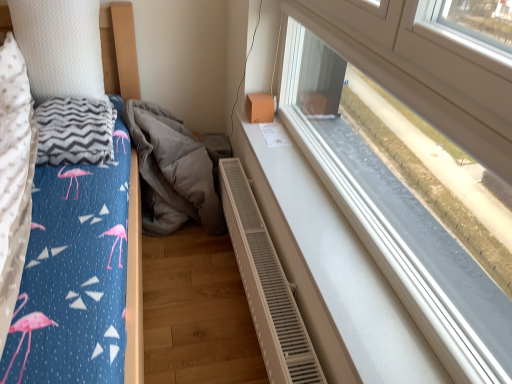
What do you see at coordinates (75, 131) in the screenshot? I see `gray zigzag-patterned blanket at left` at bounding box center [75, 131].

Image resolution: width=512 pixels, height=384 pixels. What do you see at coordinates (394, 175) in the screenshot?
I see `white plastic window at upper right` at bounding box center [394, 175].

What is the approximate height of white textured pillow at upper left?

white textured pillow at upper left is 19.61 inches tall.

Locate an element on the screen. gray zigzag-patterned blanket at left is located at coordinates (75, 131).

Based on the photo, which object is thinner, white textured radiator at lower center or white textured pillow at upper left?

With smaller width is white textured radiator at lower center.

Is the position of white textured radiator at lower center less distant than that of white textured pillow at upper left?

Yes, it is.

Identify the location of pillow lying behind the white textured radiator at lower center. The width and height of the screenshot is (512, 384). (60, 47).

Does white textured radiator at lower center have a smaller size compared to gray zigzag-patterned blanket at left?

No.

Is white textured radiator at lower center thinner than gray zigzag-patterned blanket at left?

Yes.

Which object is positioned more to the right, white textured radiator at lower center or gray zigzag-patterned blanket at left?

From the viewer's perspective, white textured radiator at lower center appears more on the right side.

Looking at this image, which is further, (133, 109) or (57, 120)?

The point (133, 109) is behind.

Is gray fabric at lower center situated inside gray zigzag-patterned blanket at left or outside?

gray fabric at lower center is not inside gray zigzag-patterned blanket at left, it's outside.

Is gray fabric at lower center in front of or behind gray zigzag-patterned blanket at left in the image?

gray fabric at lower center is positioned farther from the viewer than gray zigzag-patterned blanket at left.

From a real-world perspective, which object stands above the other?

gray zigzag-patterned blanket at left.

Which object is positioned more to the left, white plastic window at upper right or gray fabric at lower center?

Positioned to the left is gray fabric at lower center.

In the image, is white plastic window at upper right positioned in front of or behind gray fabric at lower center?

In the image, white plastic window at upper right appears in front of gray fabric at lower center.

Considering the sizes of white plastic window at upper right and gray fabric at lower center in the image, is white plastic window at upper right taller or shorter than gray fabric at lower center?

Clearly, white plastic window at upper right is taller compared to gray fabric at lower center.

Based on the photo, considering the sizes of white plastic window at upper right and gray fabric at lower center in the image, is white plastic window at upper right bigger or smaller than gray fabric at lower center?

In the image, white plastic window at upper right appears to be smaller than gray fabric at lower center.

From their relative heights in the image, would you say white textured pillow at upper left is taller or shorter than white textured radiator at lower center?

white textured pillow at upper left is taller than white textured radiator at lower center.

Consider the image. Measure the distance between white textured pillow at upper left and white textured radiator at lower center.

The distance of white textured pillow at upper left from white textured radiator at lower center is 35.66 inches.

From a real-world perspective, is white textured pillow at upper left positioned above or below white textured radiator at lower center?

From a real-world perspective, white textured pillow at upper left is physically above white textured radiator at lower center.

Based on the photo, is white textured pillow at upper left turned away from white textured radiator at lower center?

white textured pillow at upper left is not turned away from white textured radiator at lower center.

Does gray zigzag-patterned blanket at left have a smaller size compared to white textured radiator at lower center?

Yes, gray zigzag-patterned blanket at left is smaller than white textured radiator at lower center.

Based on the photo, from the image's perspective, between gray zigzag-patterned blanket at left and white textured radiator at lower center, who is located below?

white textured radiator at lower center, from the image's perspective.

How different are the orientations of gray zigzag-patterned blanket at left and white textured radiator at lower center in degrees?

The angular difference between gray zigzag-patterned blanket at left and white textured radiator at lower center is 92.5 degrees.

Does gray zigzag-patterned blanket at left have a lesser height compared to white textured radiator at lower center?

Yes, gray zigzag-patterned blanket at left is shorter than white textured radiator at lower center.

Which of these two, gray fabric at lower center or white plastic window at upper right, is smaller?

white plastic window at upper right is smaller.

Which of these two, gray fabric at lower center or white plastic window at upper right, stands taller?

Standing taller between the two is white plastic window at upper right.

How much distance is there between gray fabric at lower center and white plastic window at upper right?

→ gray fabric at lower center is 27.41 inches from white plastic window at upper right.

From a real-world perspective, which is physically above, gray fabric at lower center or white plastic window at upper right?

white plastic window at upper right, from a real-world perspective.

You are a GUI agent. You are given a task and a screenshot of the screen. Output one action in this format:
    pyautogui.click(x=<x>, y=<y>)
    Task: Click on the air conditioner below the white textured pillow at upper left (from the image's perspective)
    This screenshot has height=384, width=512.
    Given the screenshot: What is the action you would take?
    pyautogui.click(x=266, y=285)

This screenshot has width=512, height=384. What are the coordinates of `air conditioner in front of the gray zigzag-patterned blanket at left` in the screenshot? It's located at (266, 285).

From the image, which object appears to be nearer to white textured pillow at upper left, gray zigzag-patterned blanket at left or gray fabric at lower center?

gray zigzag-patterned blanket at left is closer to white textured pillow at upper left.

From the image, which object appears to be farther from gray zigzag-patterned blanket at left, white textured radiator at lower center or gray fabric at lower center?

white textured radiator at lower center is further to gray zigzag-patterned blanket at left.

Based on their spatial positions, is white plastic window at upper right or gray zigzag-patterned blanket at left further from gray fabric at lower center?

Based on the image, white plastic window at upper right appears to be further to gray fabric at lower center.

Considering their positions, is white plastic window at upper right positioned further to white textured radiator at lower center than gray zigzag-patterned blanket at left?

gray zigzag-patterned blanket at left is further to white textured radiator at lower center.

From the picture: Considering their positions, is white plastic window at upper right positioned closer to white textured radiator at lower center than white textured pillow at upper left?

Based on the image, white plastic window at upper right appears to be nearer to white textured radiator at lower center.

Based on their spatial positions, is white textured pillow at upper left or gray zigzag-patterned blanket at left closer to gray fabric at lower center?

gray zigzag-patterned blanket at left is closer to gray fabric at lower center.

Which object lies further to the anchor point gray fabric at lower center, white textured pillow at upper left or white textured radiator at lower center?

white textured pillow at upper left lies further to gray fabric at lower center than the other object.

Which object lies nearer to the anchor point white plastic window at upper right, white textured pillow at upper left or gray zigzag-patterned blanket at left?

gray zigzag-patterned blanket at left.

Find the location of a particular element. The width and height of the screenshot is (512, 384). pillow positioned between white plastic window at upper right and gray fabric at lower center from near to far is located at coordinates (60, 47).

Find the location of `blanket between white textured pillow at upper left and white textured radiator at lower center in the horizontal direction`. blanket between white textured pillow at upper left and white textured radiator at lower center in the horizontal direction is located at coordinates (75, 131).

This screenshot has height=384, width=512. I want to click on material between gray zigzag-patterned blanket at left and white textured radiator at lower center in the horizontal direction, so click(x=172, y=172).

This screenshot has height=384, width=512. In order to click on air conditioner between white plastic window at upper right and gray fabric at lower center in the front-back direction in this screenshot , I will do `click(266, 285)`.